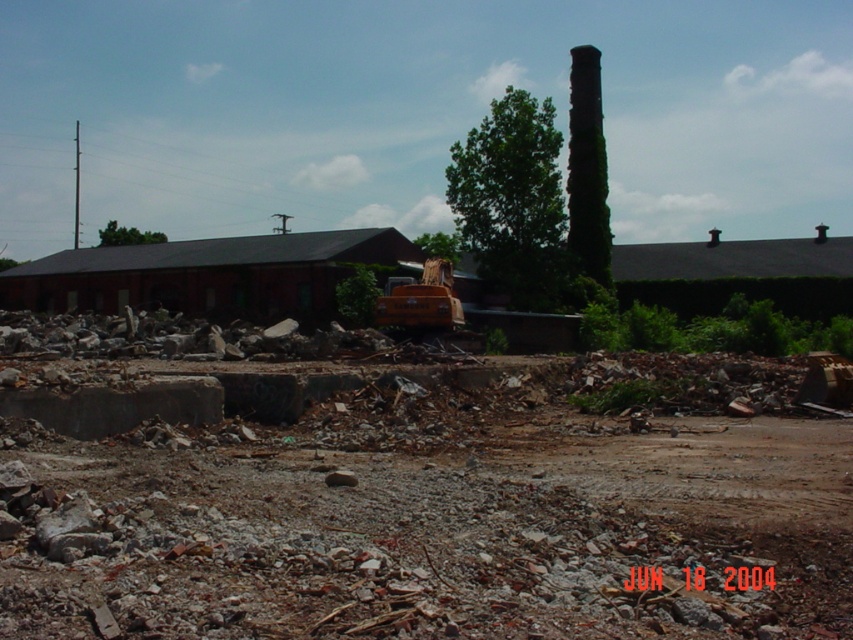
Question: Can you confirm if brown dirt track at center is positioned below orange rubber excavator at center?

Choices:
 (A) no
 (B) yes

Answer: (B)

Question: Among these points, which one is farthest from the camera?

Choices:
 (A) (640, 436)
 (B) (405, 323)

Answer: (B)

Question: Is brown dirt track at center closer to camera compared to orange rubber excavator at center?

Choices:
 (A) yes
 (B) no

Answer: (A)

Question: Does brown dirt track at center have a lesser width compared to orange rubber excavator at center?

Choices:
 (A) yes
 (B) no

Answer: (B)